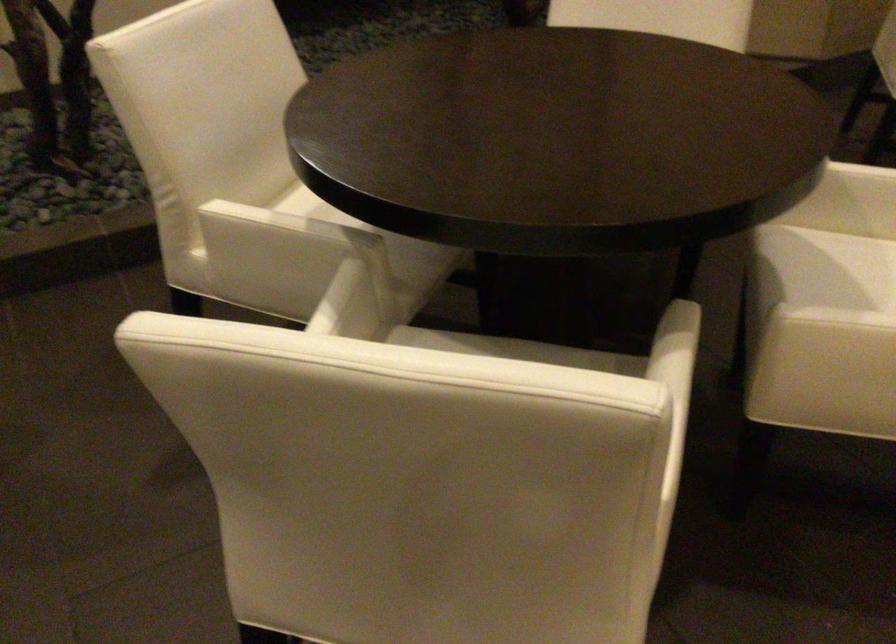
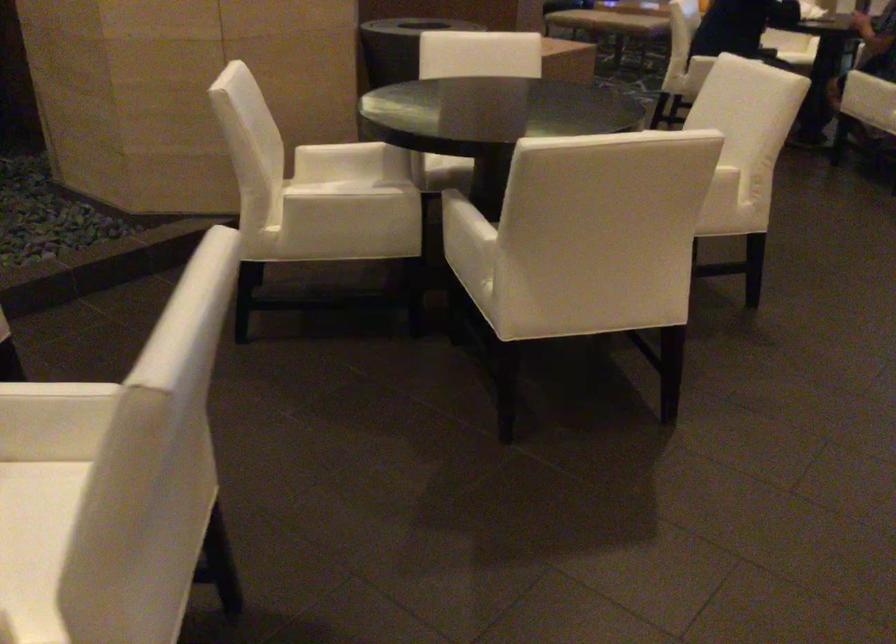
Question: What movement of the cameraman would produce the second image?

Choices:
 (A) Left
 (B) Right
 (C) Forward
 (D) Backward

Answer: (B)